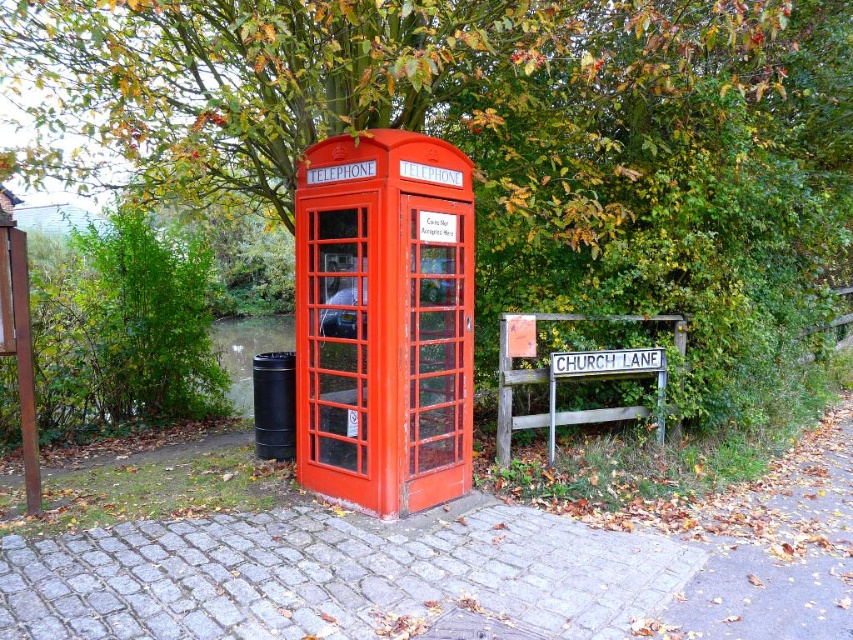
Question: Is green leafy tree at upper center above matte red telephone booth at center?

Choices:
 (A) no
 (B) yes

Answer: (B)

Question: Can you confirm if green leafy tree at upper center is smaller than matte red telephone booth at center?

Choices:
 (A) yes
 (B) no

Answer: (A)

Question: Can you confirm if green leafy tree at upper center is positioned above matte red telephone booth at center?

Choices:
 (A) no
 (B) yes

Answer: (B)

Question: Which of the following is the farthest from the observer?

Choices:
 (A) (369, 474)
 (B) (672, 224)

Answer: (B)

Question: Among these objects, which one is nearest to the camera?

Choices:
 (A) green leafy tree at upper center
 (B) matte red telephone booth at center

Answer: (B)